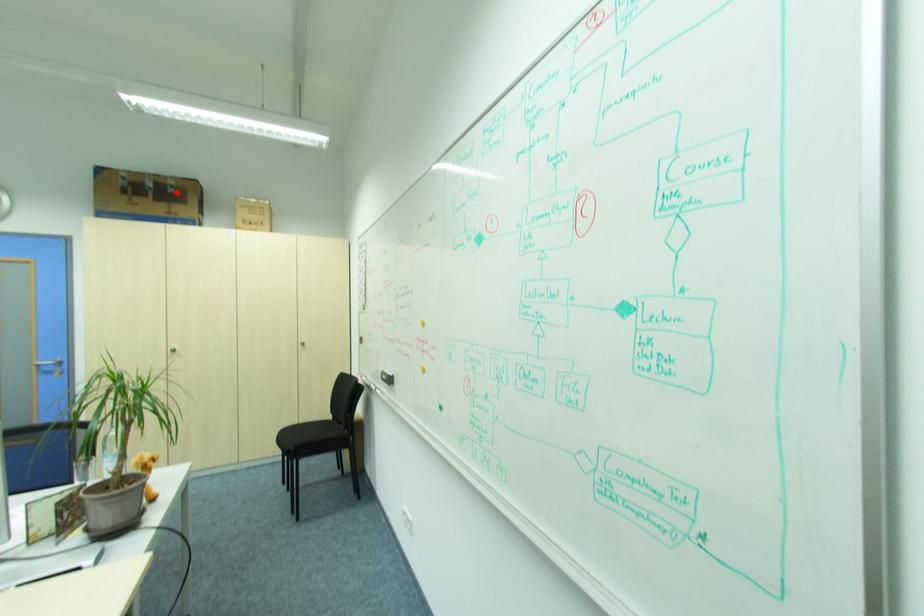
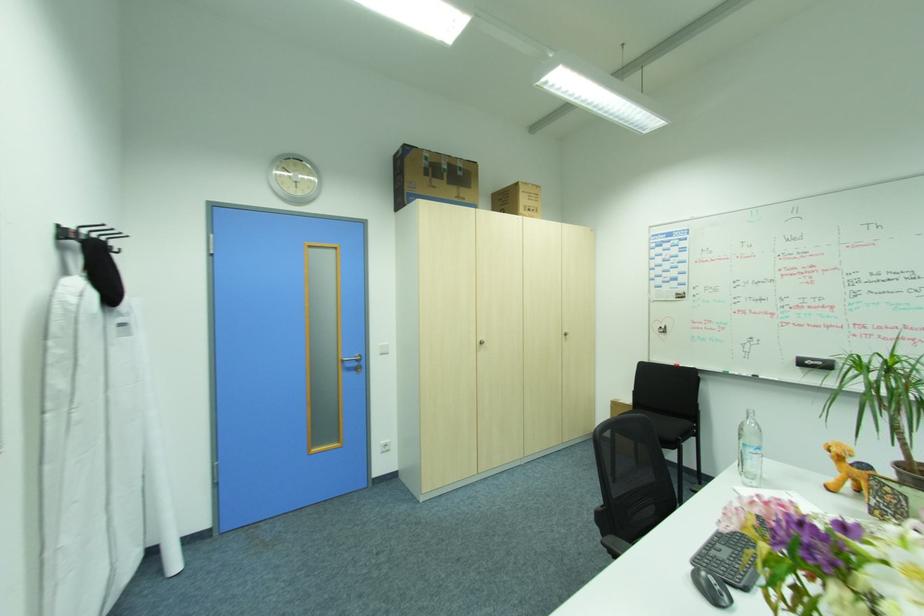
Locate, in the second image, the point that corresponds to the highlighted location in the first image.

(465, 172)